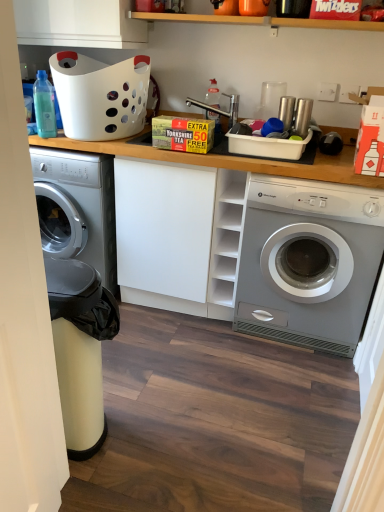
Question: Is white plastic basket at upper left positioned beyond the bounds of translucent plastic bottle at center, acting as the second bottle starting from the front?

Choices:
 (A) no
 (B) yes

Answer: (B)

Question: Is white plastic basket at upper left oriented away from translucent plastic bottle at center, which is the 1th bottle from right to left?

Choices:
 (A) yes
 (B) no

Answer: (B)

Question: Is the position of white plastic basket at upper left less distant than that of translucent plastic bottle at center, which is the 1th bottle from right to left?

Choices:
 (A) no
 (B) yes

Answer: (B)

Question: From a real-world perspective, is white plastic basket at upper left physically above translucent plastic bottle at center, acting as the 2th bottle starting from the left?

Choices:
 (A) yes
 (B) no

Answer: (A)

Question: Considering the relative sizes of white plastic basket at upper left and translucent plastic bottle at center, which is the 1th bottle from right to left, in the image provided, is white plastic basket at upper left wider than translucent plastic bottle at center, which is the 1th bottle from right to left,?

Choices:
 (A) yes
 (B) no

Answer: (A)

Question: From the image's perspective, is metallic faucet at center located above or below white plastic basket at upper left?

Choices:
 (A) above
 (B) below

Answer: (B)

Question: From a real-world perspective, is metallic faucet at center physically located above or below white plastic basket at upper left?

Choices:
 (A) above
 (B) below

Answer: (B)

Question: From their relative heights in the image, would you say metallic faucet at center is taller or shorter than white plastic basket at upper left?

Choices:
 (A) tall
 (B) short

Answer: (B)

Question: Do you think metallic faucet at center is within white plastic basket at upper left, or outside of it?

Choices:
 (A) outside
 (B) inside

Answer: (A)

Question: From a real-world perspective, is translucent plastic bottle at center, the 1th bottle from the back, above or below white matte cabinet at center?

Choices:
 (A) above
 (B) below

Answer: (A)

Question: Is translucent plastic bottle at center, acting as the second bottle starting from the front, taller or shorter than white matte cabinet at center?

Choices:
 (A) short
 (B) tall

Answer: (A)

Question: Is translucent plastic bottle at center, acting as the second bottle starting from the front, wider or thinner than white matte cabinet at center?

Choices:
 (A) thin
 (B) wide

Answer: (A)

Question: From the image's perspective, is translucent plastic bottle at center, acting as the 2th bottle starting from the left, positioned above or below white matte cabinet at center?

Choices:
 (A) below
 (B) above

Answer: (B)

Question: Is white matte cabinet at center to the left or to the right of translucent plastic bottle at upper left, which is counted as the 2th bottle, starting from the back, in the image?

Choices:
 (A) right
 (B) left

Answer: (A)

Question: Is white matte cabinet at center situated inside translucent plastic bottle at upper left, which is the second bottle in right-to-left order, or outside?

Choices:
 (A) inside
 (B) outside

Answer: (B)